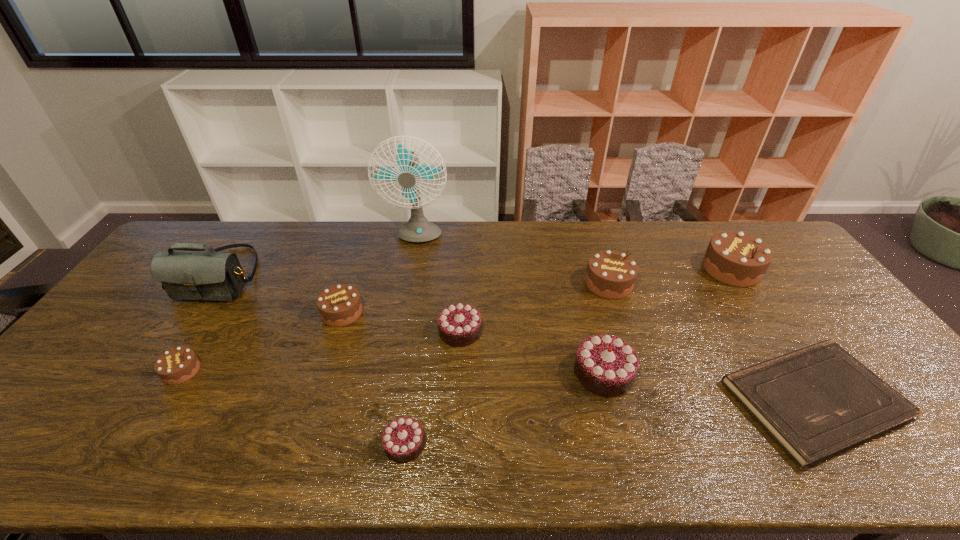
At what (x,y) coordinates should I click in order to perform the action: click on free space between the smallest brown chocolate cake and the second chocolate cake from left to right. Please return your answer as a coordinate pair (x, y). The width and height of the screenshot is (960, 540). Looking at the image, I should click on (262, 342).

You are a GUI agent. You are given a task and a screenshot of the screen. Output one action in this format:
    pyautogui.click(x=<x>, y=<y>)
    Task: Click on the free space between the fourth chocolate cake from left to right and the gray fan
    The image size is (960, 540).
    Given the screenshot: What is the action you would take?
    pyautogui.click(x=439, y=285)

Find the location of a particular element. The width and height of the screenshot is (960, 540). free space between the second farthest chocolate chocolate cake and the shoulder bag is located at coordinates (412, 324).

Where is `vacant space that's between the second biggest chocolate chocolate cake and the tallest object`? This screenshot has width=960, height=540. vacant space that's between the second biggest chocolate chocolate cake and the tallest object is located at coordinates (439, 285).

The image size is (960, 540). I want to click on free spot between the second smallest chocolate chocolate cake and the sixth shortest chocolate cake, so click(x=535, y=307).

The image size is (960, 540). I want to click on object that ranks as the fifth closest to the tallest object, so click(605, 365).

Identify which object is the fourth nearest to the nearest brown chocolate cake. Please provide its 2D coordinates. Your answer should be formatted as a tuple, i.e. [(x, y)], where the tuple contains the x and y coordinates of a point satisfying the conditions above.

[(418, 229)]

Locate which chocolate cake is the closest to the shortest chocolate cake. Please provide its 2D coordinates. Your answer should be formatted as a tuple, i.e. [(x, y)], where the tuple contains the x and y coordinates of a point satisfying the conditions above.

[(459, 325)]

Find the location of a particular element. The image size is (960, 540). chocolate cake identified as the closest to the tallest object is located at coordinates (339, 305).

The image size is (960, 540). I want to click on brown chocolate cake that is the second closest one to the farthest chocolate chocolate cake, so (x=610, y=274).